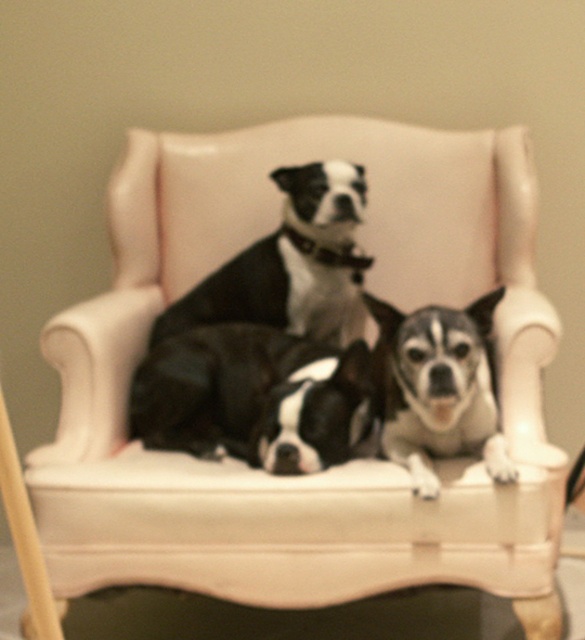
Question: Does black matte dog at center lie behind speckled fur dog at center?

Choices:
 (A) yes
 (B) no

Answer: (A)

Question: Which object is closer to the camera taking this photo?

Choices:
 (A) speckled fur dog at center
 (B) black and white fur at center
 (C) black matte dog at center

Answer: (A)

Question: Is black and white fur at center below speckled fur dog at center?

Choices:
 (A) no
 (B) yes

Answer: (A)

Question: Considering the real-world distances, which object is closest to the speckled fur dog at center?

Choices:
 (A) black and white fur at center
 (B) black matte dog at center

Answer: (A)

Question: Does black and white fur at center have a greater width compared to speckled fur dog at center?

Choices:
 (A) yes
 (B) no

Answer: (A)

Question: Which point appears closest to the camera in this image?

Choices:
 (A) (367, 380)
 (B) (405, 381)

Answer: (B)